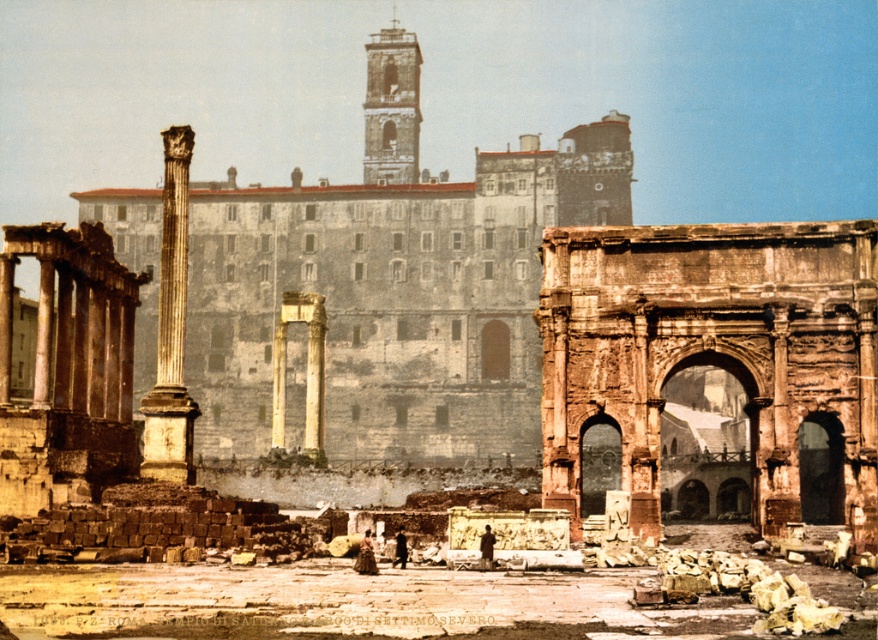
Question: From the image, what is the correct spatial relationship of stone archway at center in relation to smooth stone column at center?

Choices:
 (A) below
 (B) above

Answer: (A)

Question: Among these points, which one is nearest to the camera?

Choices:
 (A) [409, 132]
 (B) [682, 420]
 (C) [831, 456]

Answer: (C)

Question: Is rusty stone arch at center above dark stone archway at center?

Choices:
 (A) no
 (B) yes

Answer: (B)

Question: Can you confirm if yellowish stone column at left is positioned above smooth stone column at center?

Choices:
 (A) yes
 (B) no

Answer: (A)

Question: Which is nearer to the dark stone archway at center?

Choices:
 (A) stone archway at center
 (B) stone column at left
 (C) smooth stone column at center

Answer: (A)

Question: Which object is farther from the camera taking this photo?

Choices:
 (A) dark brown stone archway at center right
 (B) dark stone archway at center

Answer: (B)